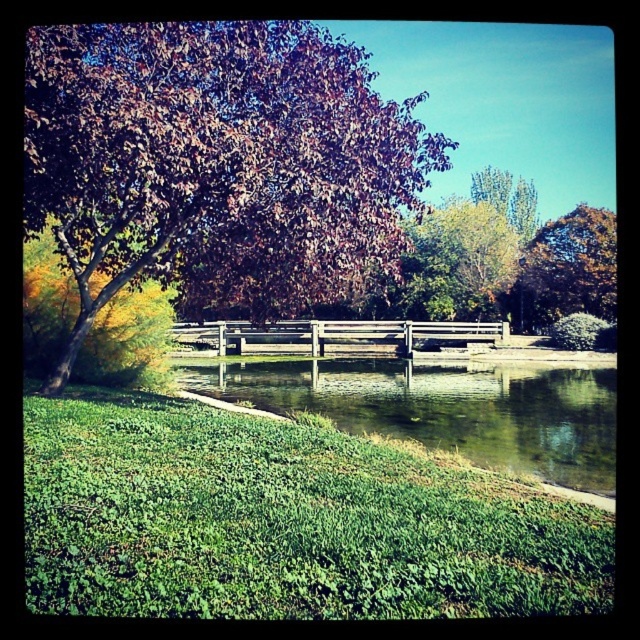
Can you confirm if green reflective water at center is positioned to the right of wooden bench at center?

No, green reflective water at center is not to the right of wooden bench at center.

Does green reflective water at center appear under wooden bench at center?

Correct, green reflective water at center is located below wooden bench at center.

This screenshot has width=640, height=640. In order to click on green reflective water at center in this screenshot , I will do `click(445, 408)`.

Where is `green reflective water at center`? green reflective water at center is located at coordinates (x=445, y=408).

Between shiny brown tree at upper left and green reflective water at center, which one appears on the left side from the viewer's perspective?

shiny brown tree at upper left is more to the left.

Does point (308, 204) come in front of point (564, 410)?

Yes, point (308, 204) is in front of point (564, 410).

Locate an element on the screen. shiny brown tree at upper left is located at coordinates (216, 163).

Is green reflective water at center to the left of brown textured tree at upper right from the viewer's perspective?

Correct, you'll find green reflective water at center to the left of brown textured tree at upper right.

How much distance is there between green reflective water at center and brown textured tree at upper right?

green reflective water at center is 84.27 feet from brown textured tree at upper right.

Describe the element at coordinates (445, 408) in the screenshot. I see `green reflective water at center` at that location.

The height and width of the screenshot is (640, 640). Identify the location of green reflective water at center. (445, 408).